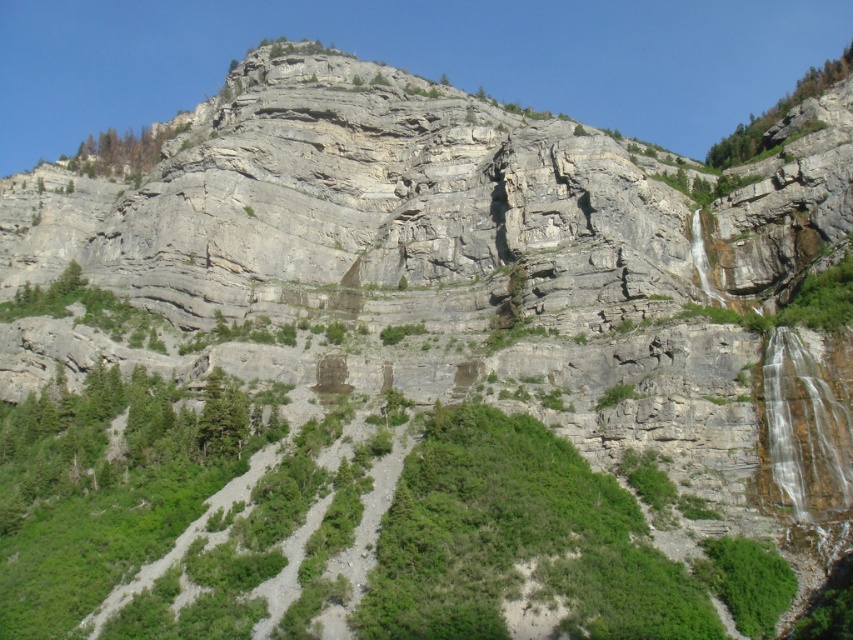
Question: Which point is closer to the camera?

Choices:
 (A) (721, 138)
 (B) (119, 148)

Answer: (B)

Question: Can you confirm if green leafy tree at upper right is positioned below yellowish-brown wood tree at upper left?

Choices:
 (A) yes
 (B) no

Answer: (B)

Question: Is green leafy tree at upper right below yellowish-brown wood tree at upper left?

Choices:
 (A) no
 (B) yes

Answer: (A)

Question: In this image, where is green leafy tree at upper right located relative to yellowish-brown wood tree at upper left?

Choices:
 (A) below
 (B) above

Answer: (B)

Question: Which point is closer to the camera?

Choices:
 (A) (157, 148)
 (B) (746, 125)

Answer: (A)